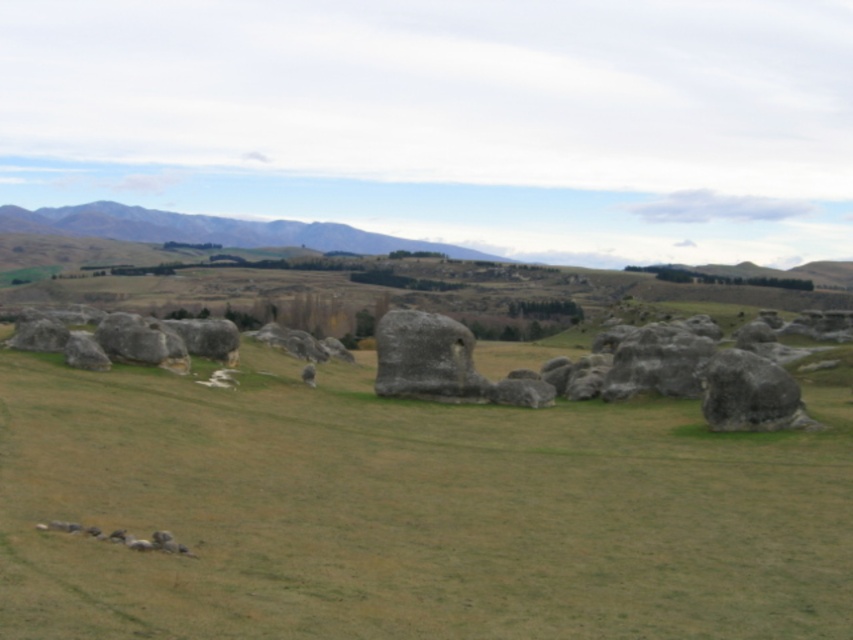
Can you confirm if gray rough stone at center is positioned to the left of smooth gray rock at center?

In fact, gray rough stone at center is to the right of smooth gray rock at center.

Does gray rough stone at center lie in front of smooth gray rock at center?

Yes, gray rough stone at center is in front of smooth gray rock at center.

Identify the location of gray rough stone at center. (425, 358).

Is green grassy field at center positioned before smooth gray rock at center?

Yes, green grassy field at center is in front of smooth gray rock at center.

Image resolution: width=853 pixels, height=640 pixels. Identify the location of green grassy field at center. (408, 512).

Is point (9, 448) closer to camera compared to point (142, 323)?

That is True.

At what (x,y) coordinates should I click in order to perform the action: click on green grassy field at center. Please return your answer as a coordinate pair (x, y). Looking at the image, I should click on (408, 512).

Which is more to the right, green grassy field at center or gray rough stone at center?

gray rough stone at center

Between point (230, 502) and point (431, 316), which one is positioned behind?

The point (431, 316) is behind.

The image size is (853, 640). I want to click on green grassy field at center, so click(x=408, y=512).